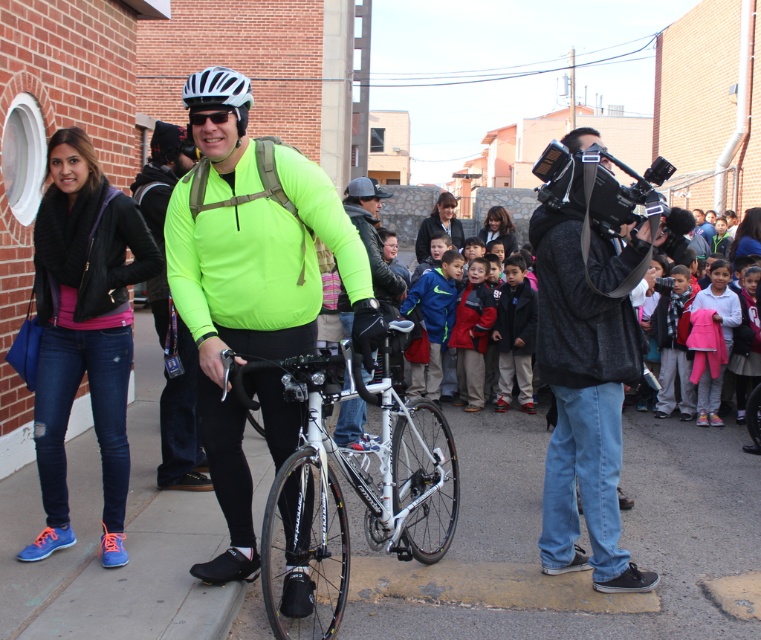
Between white asphalt at center and white matte bicycle helmet at upper center, which one is positioned higher?

white matte bicycle helmet at upper center

Is white asphalt at center positioned before white matte bicycle helmet at upper center?

That is False.

The width and height of the screenshot is (761, 640). Find the location of `white asphalt at center`. white asphalt at center is located at coordinates (537, 531).

Between matte black jacket at left and white matte helmet at center, which one is positioned higher?

white matte helmet at center is above.

Is matte black jacket at left wider than white matte helmet at center?

Yes, matte black jacket at left is wider than white matte helmet at center.

Is point (94, 236) positioned behind point (224, 88)?

Yes.

Find the location of a particular element. This screenshot has width=761, height=640. matte black jacket at left is located at coordinates (84, 330).

Between point (53, 401) and point (615, 259), which one is positioned behind?

The point (615, 259) is more distant.

Is matte black jacket at left thinner than dark gray fleece jacket at right?

No, matte black jacket at left is not thinner than dark gray fleece jacket at right.

At what (x,y) coordinates should I click in order to perform the action: click on matte black jacket at left. Please return your answer as a coordinate pair (x, y). The height and width of the screenshot is (640, 761). Looking at the image, I should click on (84, 330).